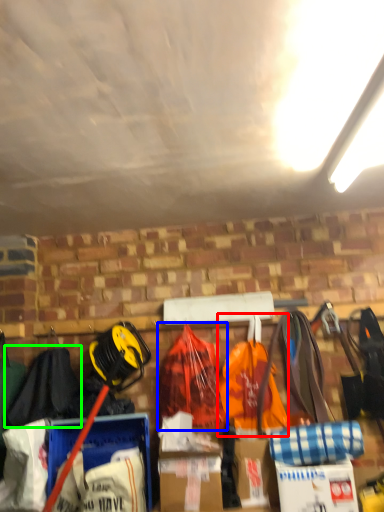
Question: Estimate the real-world distances between objects in this image. Which object is farther from grocery bag (highlighted by a red box), backpack (highlighted by a blue box) or clothing (highlighted by a green box)?

Choices:
 (A) backpack
 (B) clothing

Answer: (B)